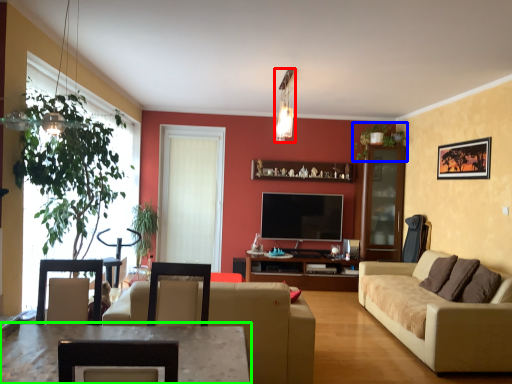
Question: Considering the real-world distances, which object is closest to light fixture (highlighted by a red box)? plant (highlighted by a blue box) or table (highlighted by a green box).

Choices:
 (A) plant
 (B) table

Answer: (A)